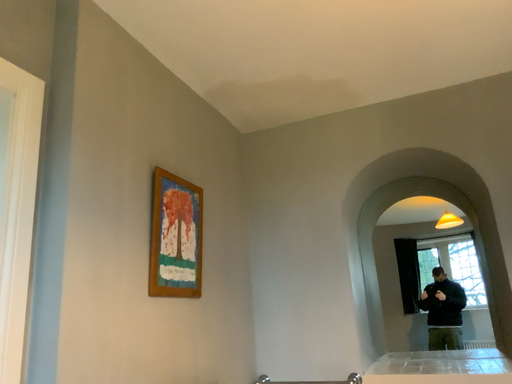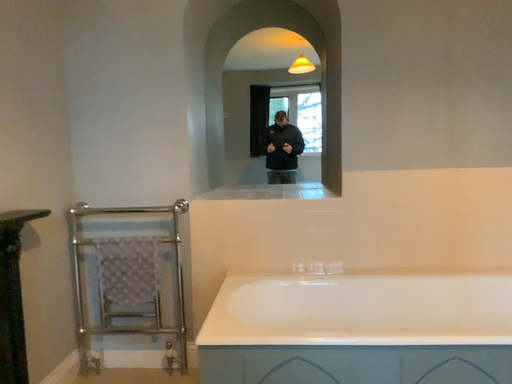
Question: How did the camera likely rotate when shooting the video?

Choices:
 (A) rotated right
 (B) rotated left

Answer: (A)